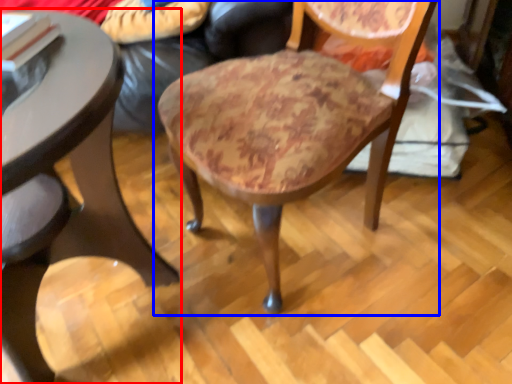
Question: Which point is further to the camera, table (highlighted by a red box) or chair (highlighted by a blue box)?

Choices:
 (A) table
 (B) chair

Answer: (B)